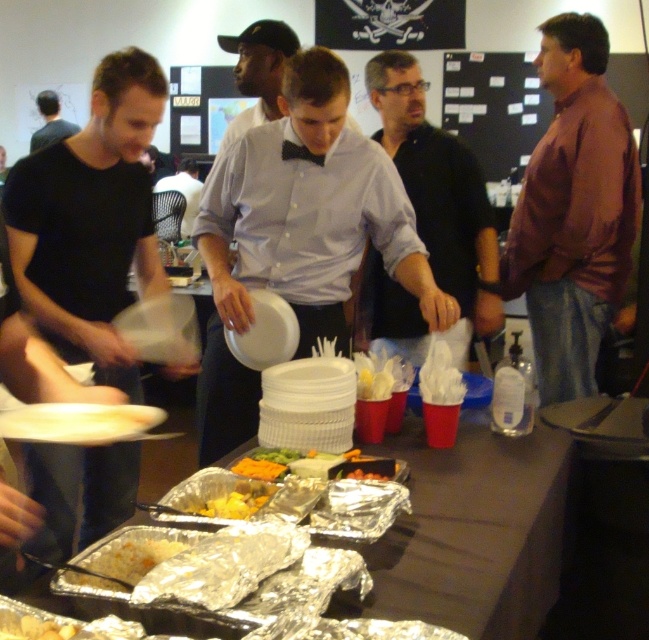
Is brown shirt at right wider than shiny aluminum foil at center?

Yes, brown shirt at right is wider than shiny aluminum foil at center.

Does brown shirt at right have a lesser height compared to shiny aluminum foil at center?

Incorrect, brown shirt at right's height does not fall short of shiny aluminum foil at center's.

Locate an element on the screen. This screenshot has height=640, width=649. brown shirt at right is located at coordinates (572, 211).

Which is more to the left, shiny aluminum foil at center or dark brown hair at upper left?

dark brown hair at upper left is more to the left.

From the picture: Can you confirm if shiny aluminum foil at center is shorter than dark brown hair at upper left?

Indeed, shiny aluminum foil at center has a lesser height compared to dark brown hair at upper left.

Is point (97, 561) closer to camera compared to point (43, 113)?

That is True.

Where is `shiny aluminum foil at center`? shiny aluminum foil at center is located at coordinates (127, 561).

Which is more to the right, black matte plate at left or brown shirt at right?

From the viewer's perspective, brown shirt at right appears more on the right side.

Can you confirm if black matte plate at left is positioned below brown shirt at right?

Correct, black matte plate at left is located below brown shirt at right.

Does point (162, 83) come behind point (583, 102)?

No, (162, 83) is in front of (583, 102).

At what (x,y) coordinates should I click in order to perform the action: click on black matte plate at left. Please return your answer as a coordinate pair (x, y). Looking at the image, I should click on (92, 220).